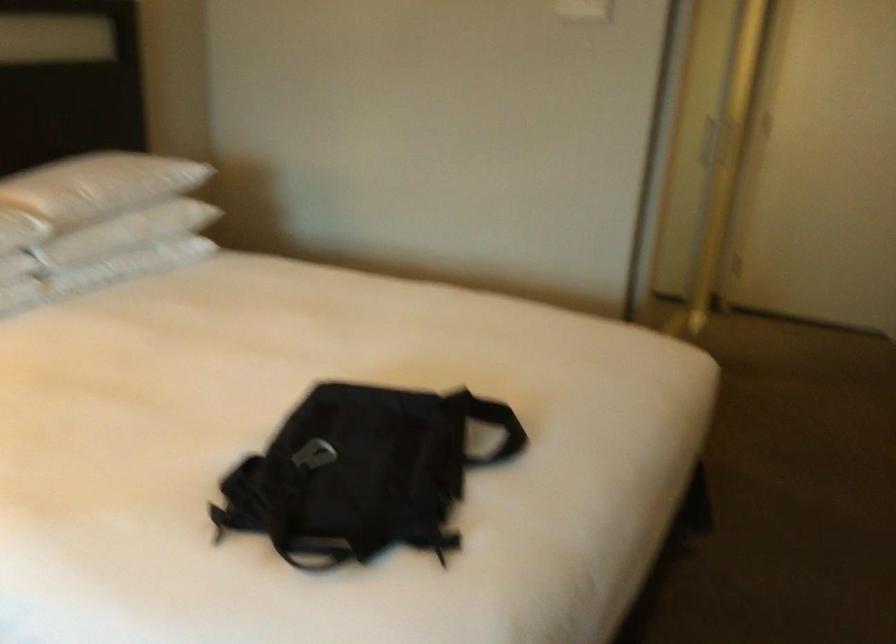
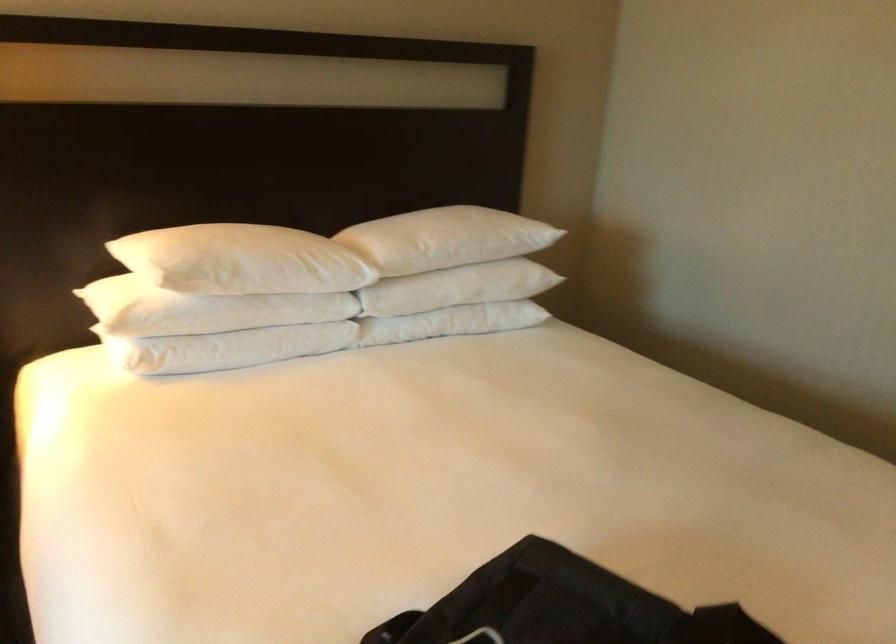
Locate, in the second image, the point that corresponds to pixel 115 183 in the first image.

(449, 238)